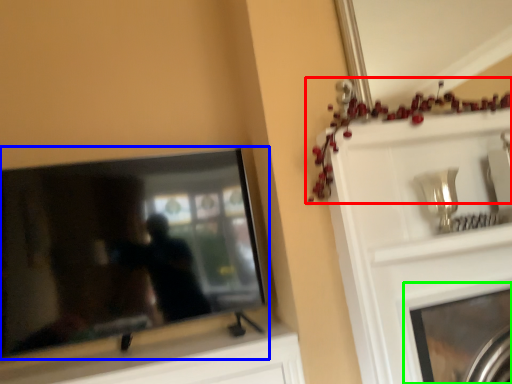
Question: Which object is positioned farthest from christmas decoration (highlighted by a red box)? Select from television (highlighted by a blue box) and fireplace (highlighted by a green box).

Choices:
 (A) television
 (B) fireplace

Answer: (A)